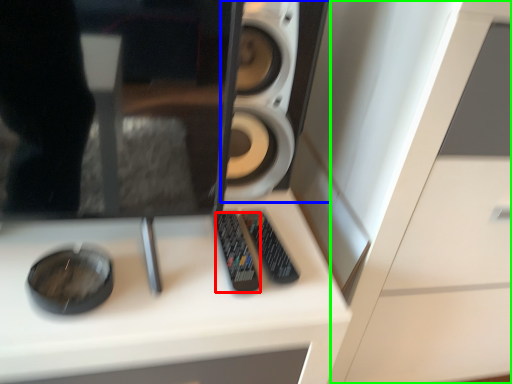
Question: Which is nearer to the control (highlighted by a red box)? speaker (highlighted by a blue box) or dresser (highlighted by a green box).

Choices:
 (A) speaker
 (B) dresser

Answer: (A)